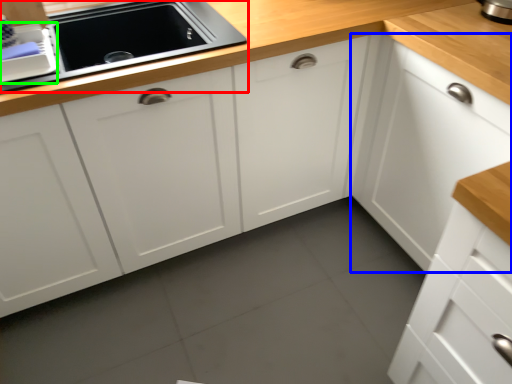
Question: Estimate the real-world distances between objects in this image. Which object is closer to home appliance (highlighted by a red box), cabinetry (highlighted by a blue box) or appliance (highlighted by a green box)?

Choices:
 (A) cabinetry
 (B) appliance

Answer: (B)